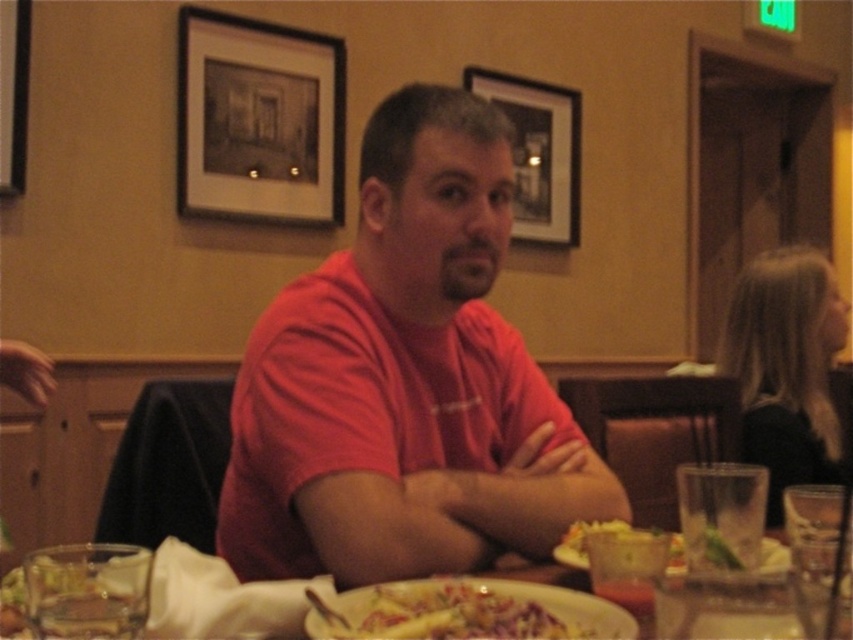
You are a waiter in a restaurant and need to place a new menu on the table. The menu is 10 cm thick. There is a translucent glass at center and a matte black picture frame at upper center on the table. Can you place the menu between them without moving either the glass or the frame?

The translucent glass at center is behind the matte black picture frame at upper center, so placing the menu between them would require the menu to be placed in front of the glass and behind the frame. However, since the glass is already behind the frame, there is no space between them for the menu. Therefore, you cannot place the menu between the translucent glass at center and the matte black picture frame at upper center without moving either object.

You are a waiter in a restaurant and need to serve a customer who ordered a large drink. You have a translucent glass at center and a transparent plastic cup at lower right on the table. Which one should you choose to pour the drink into?

The transparent plastic cup at lower right should be chosen because it is larger than the translucent glass at center.